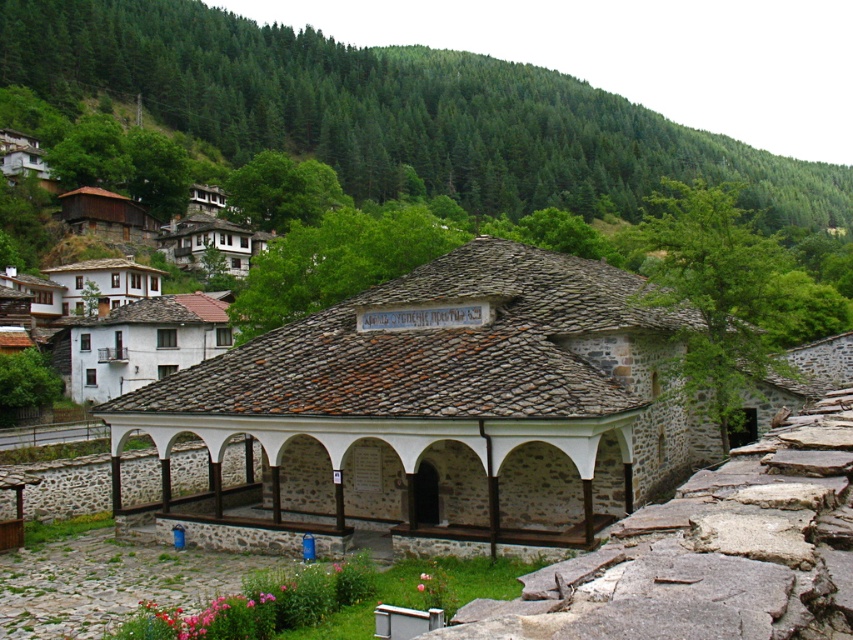
You are standing at the camera position and want to reach the point marked as point (351, 476). Can you estimate how far you need to walk to reach it?

The point (351, 476) is 28.08 meters away from the camera, so you need to walk approximately 28.08 meters to reach it.